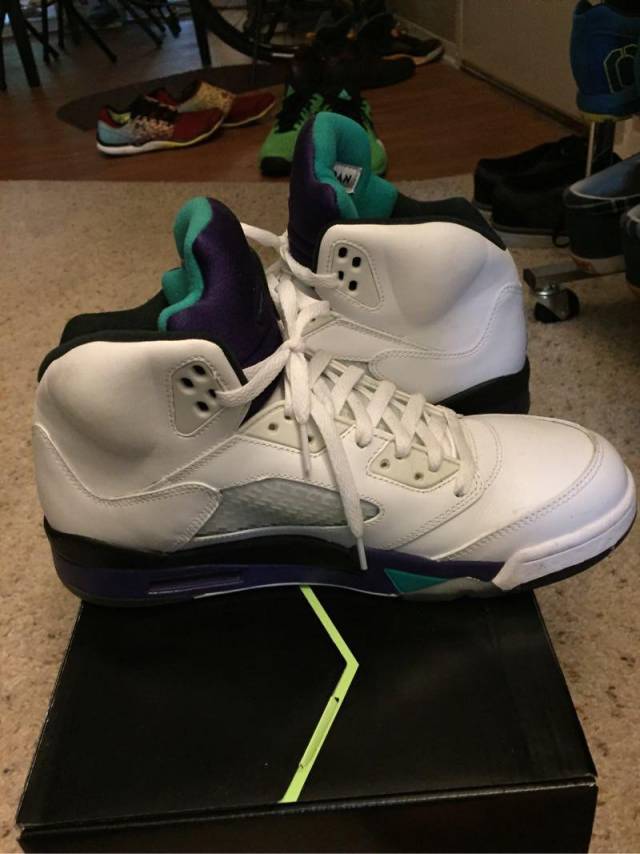
The height and width of the screenshot is (854, 640). What are the coordinates of `floor` in the screenshot? It's located at (602, 664).